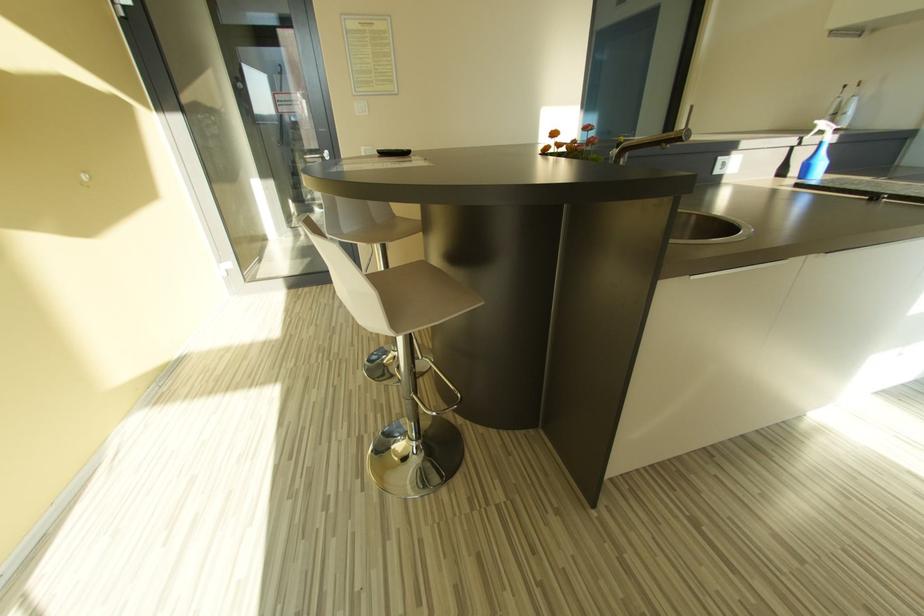
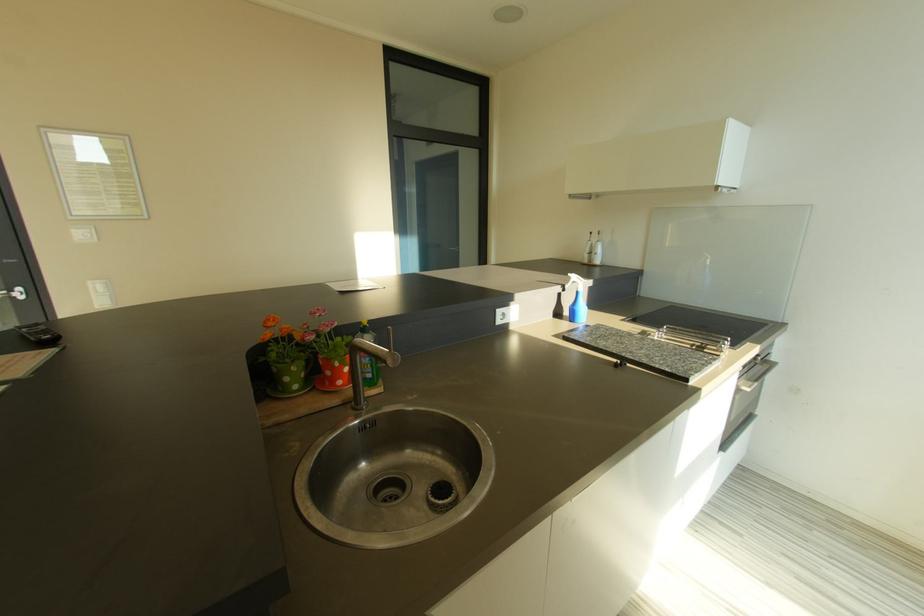
Question: The camera is either moving clockwise (left) or counter-clockwise (right) around the object. The first image is from the beginning of the video and the second image is from the end. Is the camera moving left or right when shooting the video?

Choices:
 (A) Left
 (B) Right

Answer: (A)